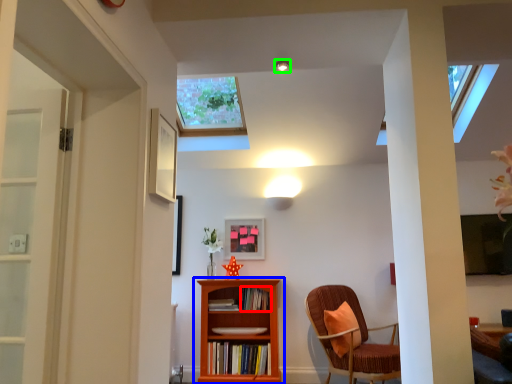
Question: Which is farther away from book (highlighted by a red box)? bookcase (highlighted by a blue box) or light fixture (highlighted by a green box)?

Choices:
 (A) bookcase
 (B) light fixture

Answer: (B)